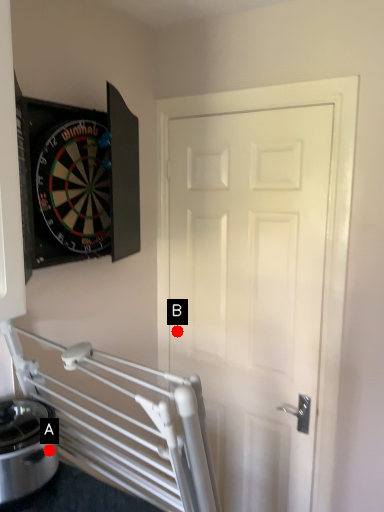
Question: Two points are circled on the image, labeled by A and B beside each circle. Which point is closer to the camera taking this photo?

Choices:
 (A) A is closer
 (B) B is closer

Answer: (A)